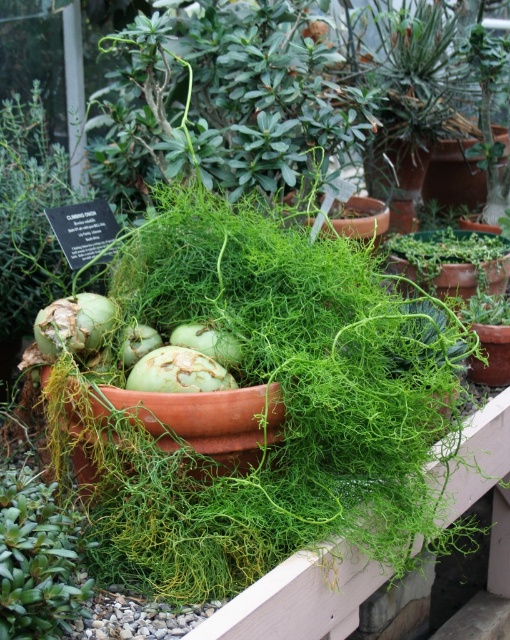
Question: Which point is farther to the camera?

Choices:
 (A) (204, 348)
 (B) (141, 372)
 (C) (4, 632)

Answer: (A)

Question: Does green matte coconut at center appear over green matte fennel bulb at center?

Choices:
 (A) no
 (B) yes

Answer: (B)

Question: Does green matte succulent at lower left have a lesser width compared to green matte vegetable at center?

Choices:
 (A) no
 (B) yes

Answer: (B)

Question: In this image, where is green matte vegetable at center located relative to green matte fennel bulb at center?

Choices:
 (A) left
 (B) right

Answer: (A)

Question: Estimate the real-world distances between objects in this image. Which object is farther from the green matte fennel bulb at center?

Choices:
 (A) green matte coconut at center
 (B) green matte succulent at lower left
 (C) green matte vegetable at center

Answer: (B)

Question: Which point is farther to the camera?

Choices:
 (A) green matte fennel bulb at center
 (B) green matte succulent at lower left
 (C) green matte coconut at center

Answer: (A)